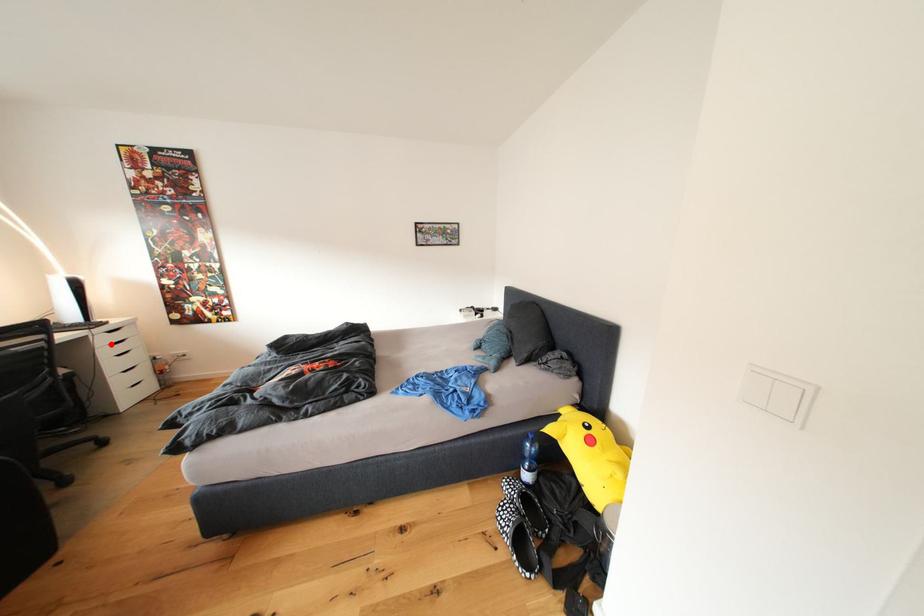
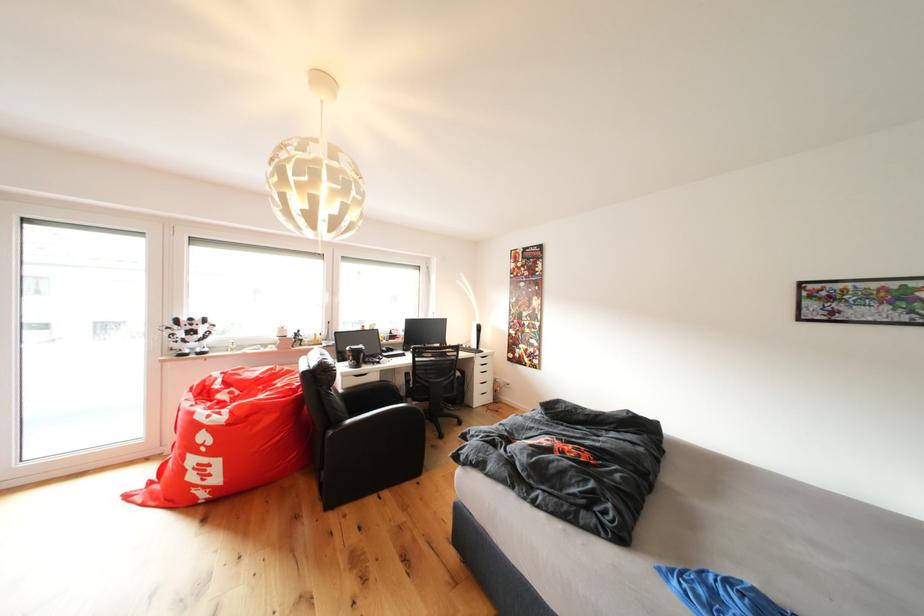
Locate, in the second image, the point that corresponds to the highlighted location in the first image.

(487, 366)